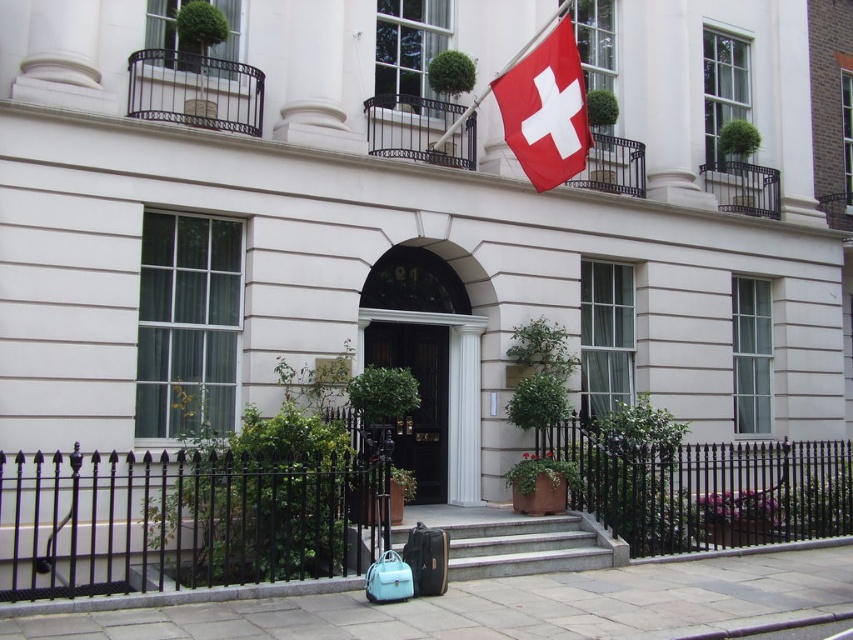
Question: Which of the following is the farthest from the observer?

Choices:
 (A) black wooden door at center
 (B) smooth concrete stairs at center

Answer: (A)

Question: Does red fabric flag at upper right have a smaller size compared to black wooden door at center?

Choices:
 (A) no
 (B) yes

Answer: (A)

Question: Observing the image, what is the correct spatial positioning of red fabric flag at upper right in reference to smooth concrete stairs at center?

Choices:
 (A) above
 (B) below

Answer: (A)

Question: Considering the relative positions of red fabric flag at upper right and smooth concrete stairs at center in the image provided, where is red fabric flag at upper right located with respect to smooth concrete stairs at center?

Choices:
 (A) above
 (B) below

Answer: (A)

Question: Which object appears closest to the camera in this image?

Choices:
 (A) black wooden door at center
 (B) red fabric flag at upper right

Answer: (B)

Question: Which point is farther to the camera?

Choices:
 (A) (399, 461)
 (B) (473, 538)

Answer: (A)